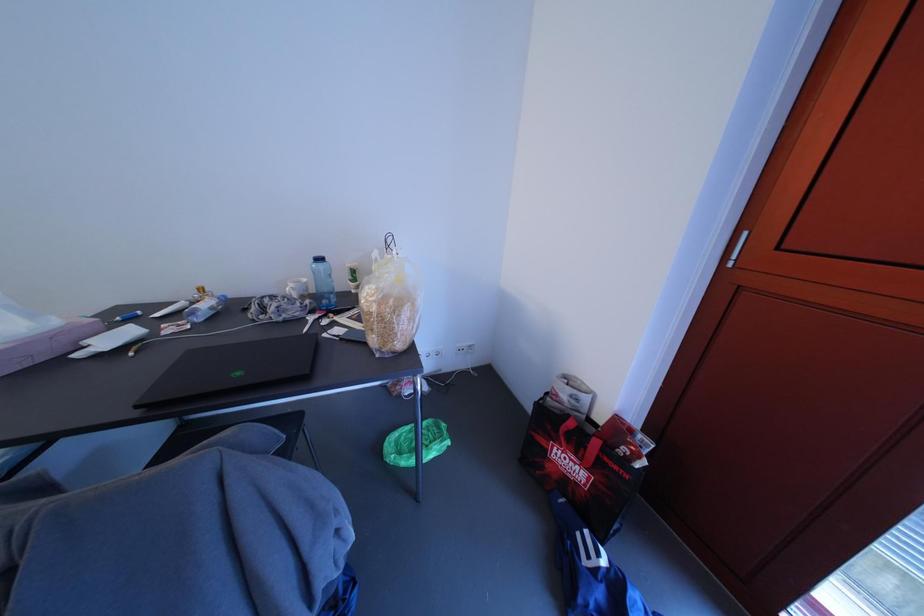
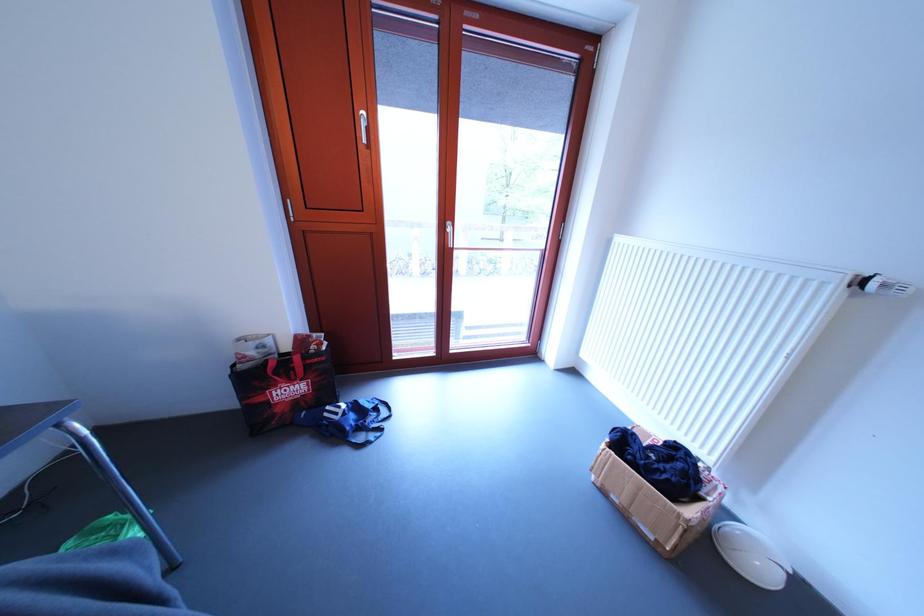
How did the camera likely rotate?

The rotation direction of the camera is right-down.